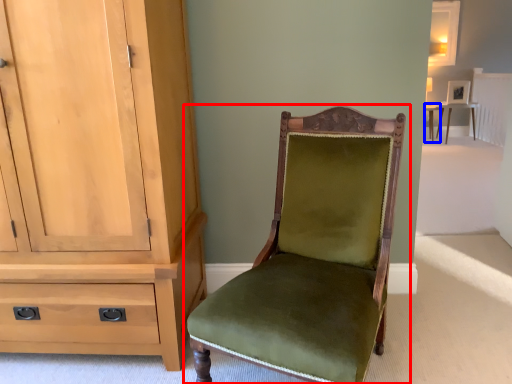
Question: Which object appears farthest to the camera in this image, chair (highlighted by a red box) or table (highlighted by a blue box)?

Choices:
 (A) chair
 (B) table

Answer: (B)